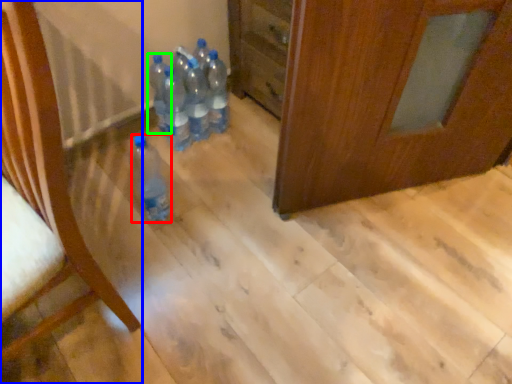
Question: Estimate the real-world distances between objects in this image. Which object is closer to bottle (highlighted by a red box), furniture (highlighted by a blue box) or bottle (highlighted by a green box)?

Choices:
 (A) furniture
 (B) bottle

Answer: (B)